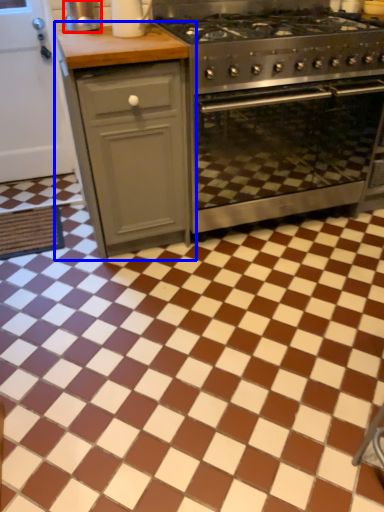
Question: Among these objects, which one is farthest to the camera, appliance (highlighted by a red box) or cabinetry (highlighted by a blue box)?

Choices:
 (A) appliance
 (B) cabinetry

Answer: (A)